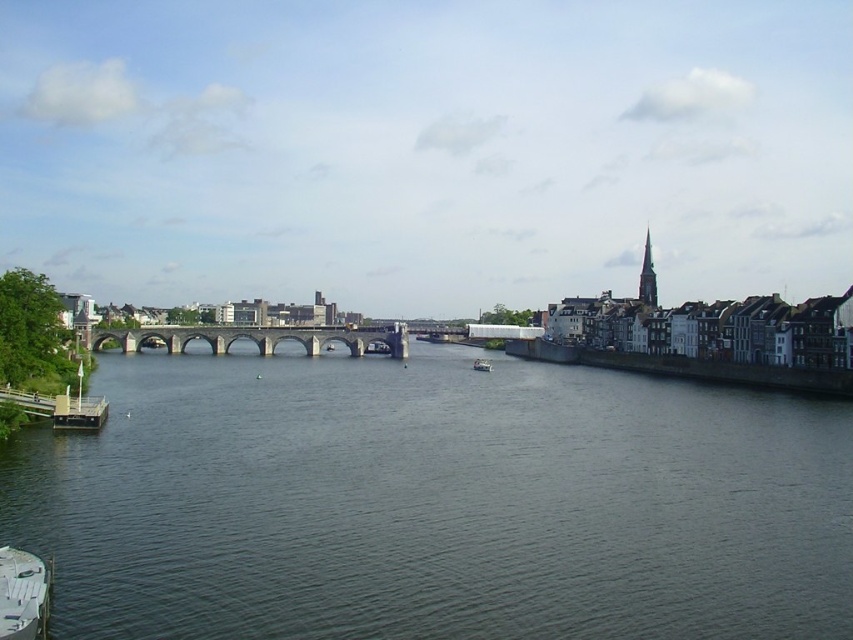
You are a photographer planning to capture the entire scene of the riverside and the stone bridge. You notice two white plastic boats in the image. Which boat, the white plastic boat at lower left or the white plastic boat at center, would appear closer to the camera based on their sizes?

The white plastic boat at lower left appears closer to the camera because it has a smaller size compared to the white plastic boat at center, indicating it is farther away.

You are a tourist standing on the riverside and want to take a photo of the white plastic boat at lower left and the metallic gray boat at lower left. Which boat should you focus on first if you want to capture both in the frame without moving your camera?

You should focus on the metallic gray boat at lower left first because the white plastic boat at lower left is positioned under it, so adjusting the camera angle to include the lower boat might require a slight downward tilt to ensure both are in the frame.

You are a photographer planning to capture the church spire in the background along with the boats at the lower left. Which boat, the white plastic boat at lower left or the metallic gray boat at lower left, will appear smaller in the photo due to its position?

The white plastic boat at lower left has a lesser height compared to the metallic gray boat at lower left, so it will appear smaller in the photo.